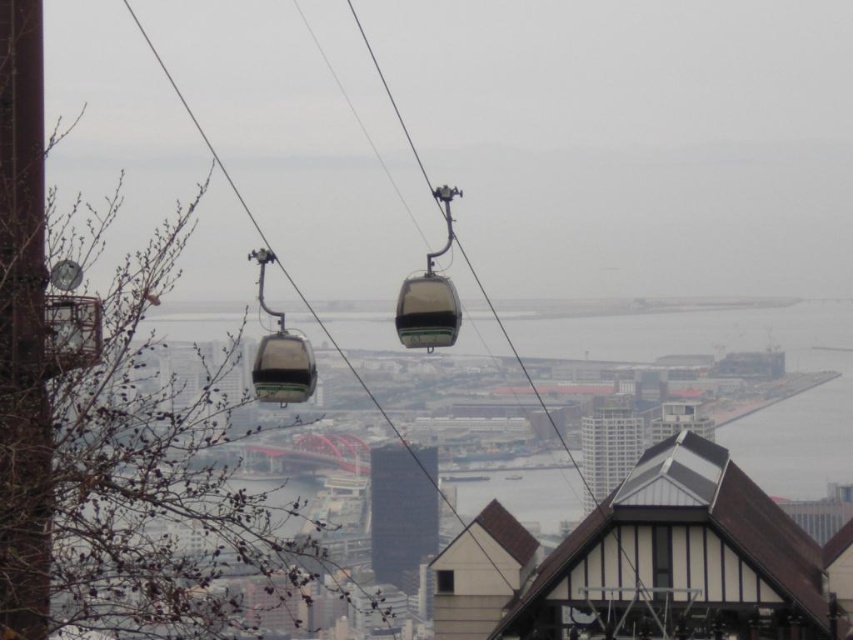
Between matte black cable car at center and transparent glass cabin at center, which one appears on the left side from the viewer's perspective?

matte black cable car at center

Does matte black cable car at center appear on the left side of transparent glass cabin at center?

Yes, matte black cable car at center is to the left of transparent glass cabin at center.

Which is in front, point (282, 401) or point (444, 284)?

Positioned in front is point (444, 284).

This screenshot has height=640, width=853. Identify the location of matte black cable car at center. point(280,353).

Measure the distance between matte black cable car at center and camera.

matte black cable car at center is 633.04 meters away from camera.

Locate an element on the screen. This screenshot has height=640, width=853. matte black cable car at center is located at coordinates (280, 353).

Which of these two, transparent glass cabin at center or translucent plastic gondola at center, stands taller?

With more height is transparent glass cabin at center.

Does point (426, 336) lie behind point (306, 348)?

That is False.

Where is `transparent glass cabin at center`? Image resolution: width=853 pixels, height=640 pixels. transparent glass cabin at center is located at coordinates (427, 310).